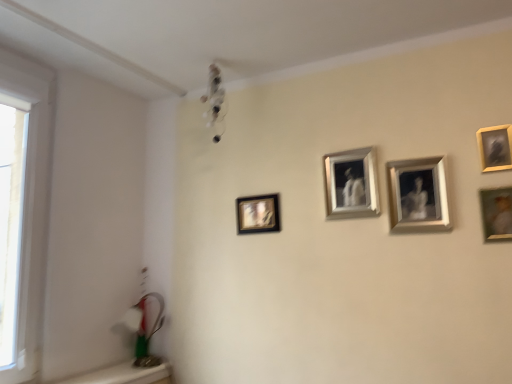
Question: Is matte silver picture frame at right, marked as the 1th picture frame in a right-to-left arrangement, further to the viewer compared to transparent glass window at left?

Choices:
 (A) yes
 (B) no

Answer: (A)

Question: From the image's perspective, is matte silver picture frame at right, marked as the 1th picture frame in a right-to-left arrangement, below transparent glass window at left?

Choices:
 (A) no
 (B) yes

Answer: (A)

Question: Is matte silver picture frame at right, marked as the 5th picture frame in a left-to-right arrangement, at the left side of transparent glass window at left?

Choices:
 (A) no
 (B) yes

Answer: (A)

Question: Would you say matte silver picture frame at right, marked as the 5th picture frame in a left-to-right arrangement, contains transparent glass window at left?

Choices:
 (A) yes
 (B) no

Answer: (B)

Question: Is matte silver picture frame at right, marked as the 5th picture frame in a left-to-right arrangement, outside of transparent glass window at left?

Choices:
 (A) no
 (B) yes

Answer: (B)

Question: Can you confirm if matte silver picture frame at right, marked as the 1th picture frame in a right-to-left arrangement, is thinner than transparent glass window at left?

Choices:
 (A) no
 (B) yes

Answer: (B)

Question: Does wooden frame at upper right, which is counted as the second picture frame, starting from the right, turn towards silver metallic frame at center, the 4th picture frame when ordered from right to left?

Choices:
 (A) yes
 (B) no

Answer: (B)

Question: Is wooden frame at upper right, which is counted as the second picture frame, starting from the right, in front of silver metallic frame at center, the 2th picture frame positioned from the left?

Choices:
 (A) no
 (B) yes

Answer: (B)

Question: Does wooden frame at upper right, which is counted as the second picture frame, starting from the right, appear on the right side of silver metallic frame at center, the 4th picture frame when ordered from right to left?

Choices:
 (A) yes
 (B) no

Answer: (A)

Question: From the image's perspective, is wooden frame at upper right, which is counted as the second picture frame, starting from the right, below silver metallic frame at center, the 2th picture frame positioned from the left?

Choices:
 (A) no
 (B) yes

Answer: (A)

Question: Is wooden frame at upper right, which is the 4th picture frame in left-to-right order, outside of silver metallic frame at center, the 2th picture frame positioned from the left?

Choices:
 (A) no
 (B) yes

Answer: (B)

Question: Is silver metallic frame at center, the 4th picture frame when ordered from right to left, a part of wooden frame at upper right, which is the 4th picture frame in left-to-right order?

Choices:
 (A) yes
 (B) no

Answer: (B)

Question: Can metallic silver picture frame at upper right, the third picture frame from the right, be found inside matte black picture frame at center left, positioned as the 5th picture frame in right-to-left order?

Choices:
 (A) yes
 (B) no

Answer: (B)